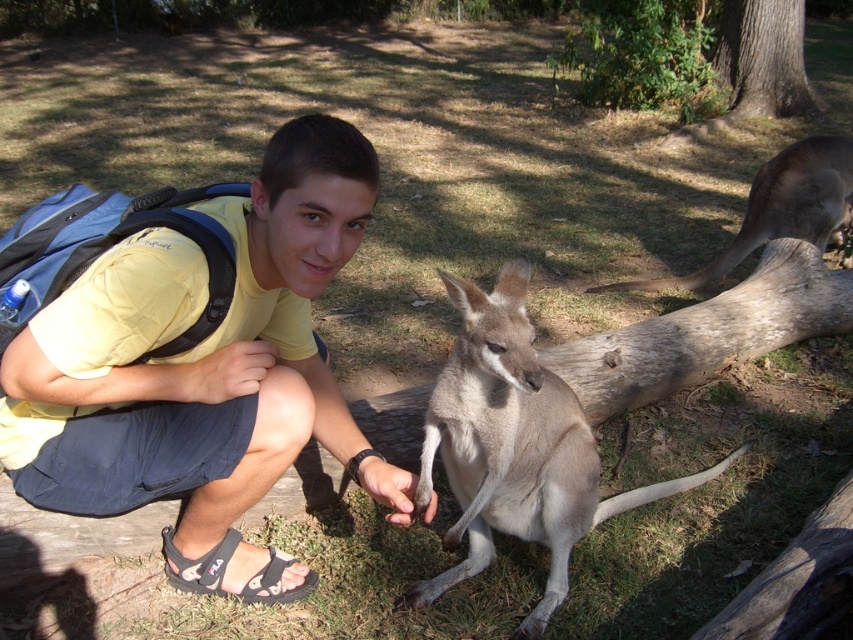
Which is below, yellow fabric shirt at center or light brown fur at center?

Positioned lower is light brown fur at center.

Does point (199, 280) come closer to viewer compared to point (520, 460)?

That is True.

This screenshot has width=853, height=640. I want to click on yellow fabric shirt at center, so click(x=202, y=371).

In the scene shown: Is light brown fur at center shorter than brown fur at right?

Yes.

Between point (506, 461) and point (793, 188), which one is positioned behind?

The point (793, 188) is behind.

Identify the location of light brown fur at center. (514, 445).

Image resolution: width=853 pixels, height=640 pixels. Find the location of `yellow fabric shirt at center`. yellow fabric shirt at center is located at coordinates (202, 371).

This screenshot has width=853, height=640. Identify the location of yellow fabric shirt at center. (202, 371).

Image resolution: width=853 pixels, height=640 pixels. Identify the location of yellow fabric shirt at center. (202, 371).